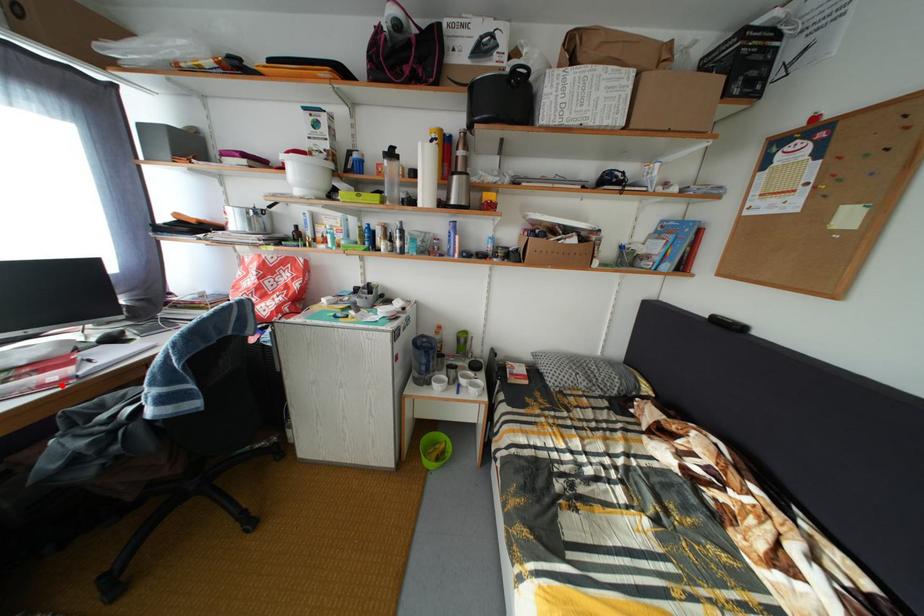
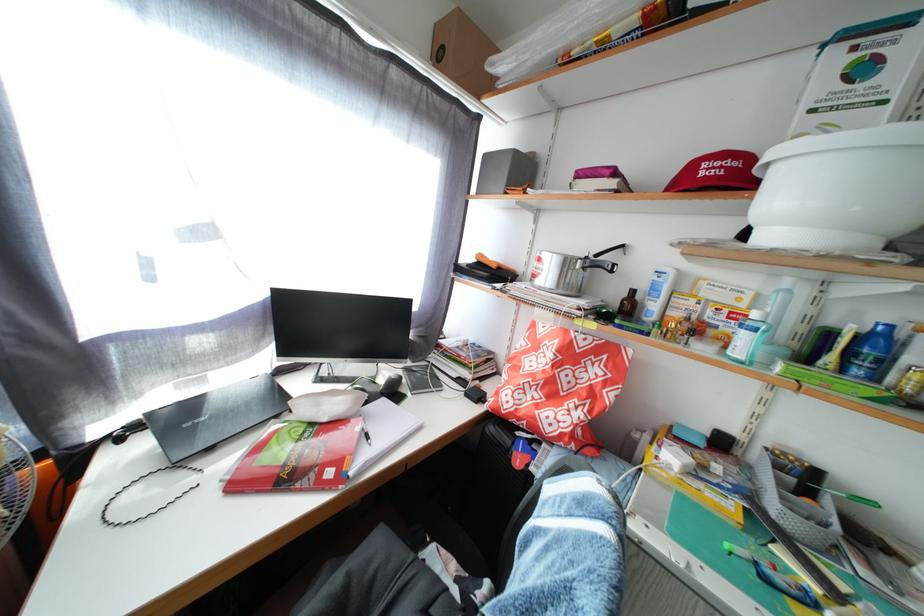
Locate, in the second image, the point that corresponds to the highlighted location in the first image.

(338, 480)